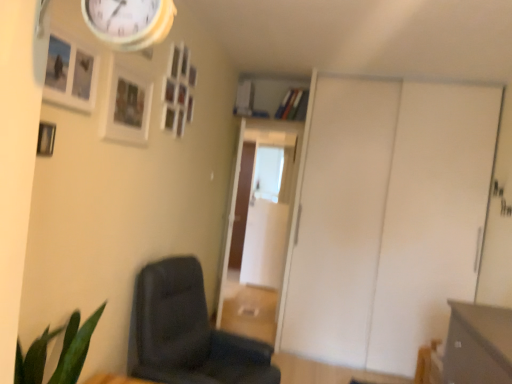
Question: Considering the positions of point (90, 62) and point (252, 289), is point (90, 62) closer or farther from the camera than point (252, 289)?

Choices:
 (A) farther
 (B) closer

Answer: (B)

Question: Would you say wooden picture frame at upper left, the fourth picture frame when ordered from back to front, is to the left or to the right of transparent glass door at center, which is counted as the 1th glass door, starting from the front, in the picture?

Choices:
 (A) right
 (B) left

Answer: (B)

Question: Which of these objects is positioned farthest from the matte gray drawer at lower right?

Choices:
 (A) wooden picture frame at upper left, which appears as the 3th picture frame when viewed from the back
 (B) transparent glass door at center, which is counted as the 1th glass door, starting from the front
 (C) wooden photo frame at upper center, positioned as the fourth picture frame in front-to-back order
 (D) wooden picture frame at upper left, the second picture frame from the back
 (E) dark gray fabric chair at lower left

Answer: (B)

Question: Which object is positioned closest to the transparent glass door at center, the first glass door when ordered from back to front?

Choices:
 (A) wooden picture frame at upper left, which appears as the third picture frame when viewed from the front
 (B) dark gray fabric chair at lower left
 (C) white matte sliding door at right
 (D) wooden picture frame at upper left, arranged as the 2th picture frame when viewed from the front
 (E) wooden picture frame at upper left, the fourth picture frame when ordered from back to front

Answer: (C)